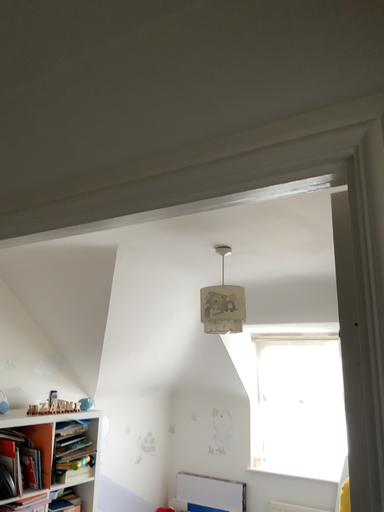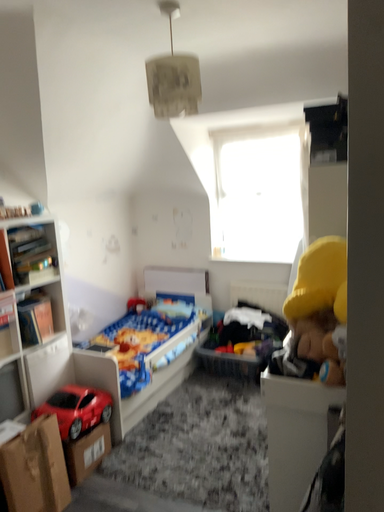
Question: How did the camera likely rotate when shooting the video?

Choices:
 (A) rotated downward
 (B) rotated upward

Answer: (A)